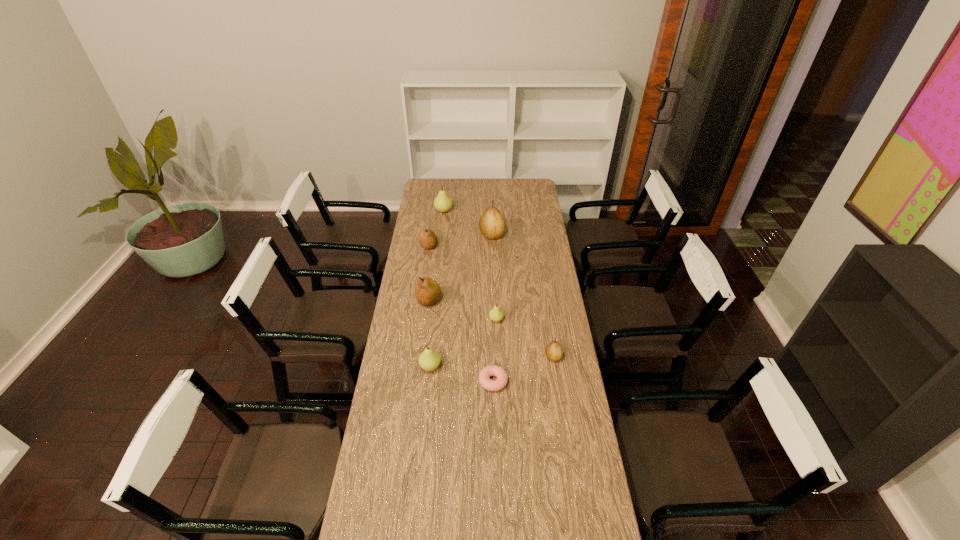
The image size is (960, 540). I want to click on the biggest brown pear, so click(492, 225).

At what (x,y) coordinates should I click in order to perform the action: click on the third brown pear from left to right. Please return your answer as a coordinate pair (x, y). Image resolution: width=960 pixels, height=540 pixels. Looking at the image, I should click on pyautogui.click(x=492, y=225).

Identify the location of the biggest green pear. (443, 203).

Locate an element on the screen. The image size is (960, 540). the farthest pear is located at coordinates (443, 203).

Find the location of a particular element. The width and height of the screenshot is (960, 540). the third farthest brown pear is located at coordinates (427, 291).

Where is `the fourth farthest object`? the fourth farthest object is located at coordinates click(x=427, y=291).

At what (x,y) coordinates should I click in order to perform the action: click on the second smallest brown pear. Please return your answer as a coordinate pair (x, y). This screenshot has height=540, width=960. Looking at the image, I should click on coord(428,239).

You are a GUI agent. You are given a task and a screenshot of the screen. Output one action in this format:
    pyautogui.click(x=<x>, y=<y>)
    Task: Click on the nearest green pear
    This screenshot has width=960, height=540.
    Given the screenshot: What is the action you would take?
    pyautogui.click(x=429, y=360)

Where is `the smallest green pear`? This screenshot has width=960, height=540. the smallest green pear is located at coordinates (496, 314).

Locate an element on the screen. This screenshot has height=540, width=960. the second nearest green pear is located at coordinates (496, 314).